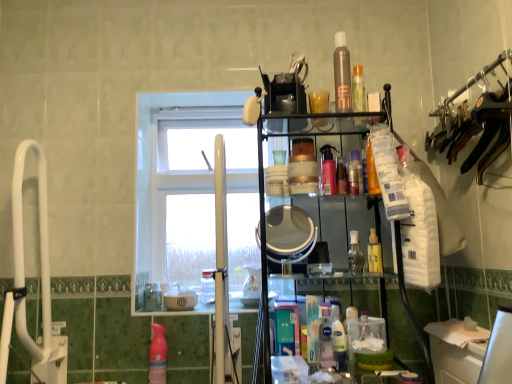
Question: Looking at their shapes, would you say pink glossy spray bottle at center, acting as the 5th toiletry starting from the bottom, is wider or thinner than white glass window at center?

Choices:
 (A) thin
 (B) wide

Answer: (A)

Question: Is pink glossy spray bottle at center, marked as the second toiletry in a top-to-bottom arrangement, taller or shorter than white glass window at center?

Choices:
 (A) short
 (B) tall

Answer: (A)

Question: Estimate the real-world distances between objects in this image. Which object is closer to the clear glass bottle at center, marked as the fifth toiletry in a top-to-bottom arrangement?

Choices:
 (A) clear plastic bottle at center
 (B) satin brown spray can at upper center, positioned as the 6th toiletry in bottom-to-top order
 (C) translucent plastic spray bottle at center, the 4th toiletry in the top-to-bottom sequence
 (D) translucent plastic spray bottle at lower center, which is the 2th cleaning product from left to right
 (E) pink glossy spray bottle at center, marked as the second toiletry in a top-to-bottom arrangement

Answer: (D)

Question: Considering the real-world distances, which object is closest to the translucent plastic bottle at lower center, positioned as the 2th cleaning product in front-to-back order?

Choices:
 (A) matte silver mirror at center
 (B) pink glossy spray bottle at center, marked as the second toiletry in a top-to-bottom arrangement
 (C) satin brown spray can at upper center, the 1th toiletry viewed from the top
 (D) pink glossy bottle at center, positioned as the fourth toiletry in bottom-to-top order
 (E) translucent plastic spray bottle at lower center, which is the third cleaning product in back-to-front order

Answer: (E)